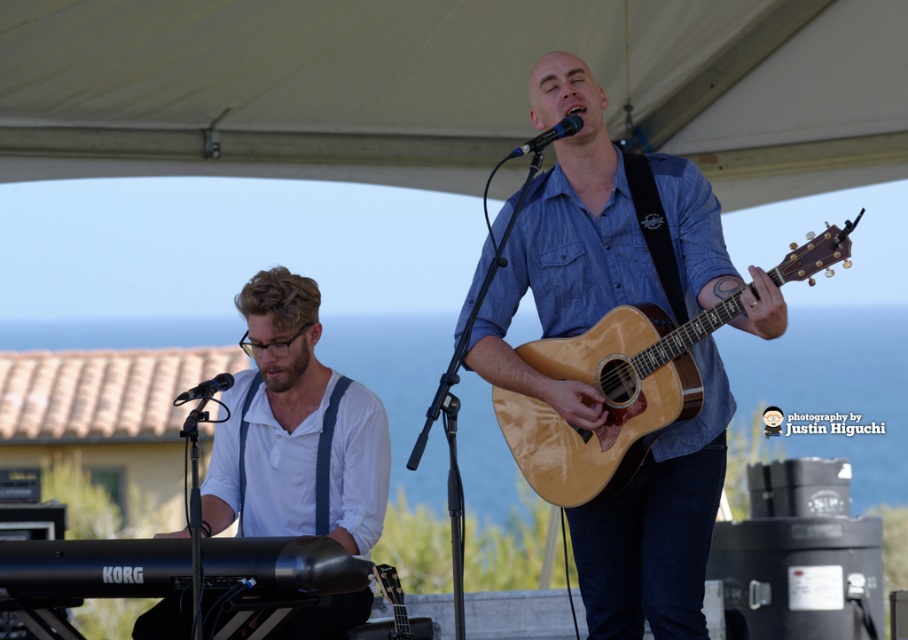
Question: Does denim shirt at center have a larger size compared to white cotton shirt at left?

Choices:
 (A) no
 (B) yes

Answer: (B)

Question: Based on their relative distances, which object is farther from the glossy wood guitar at center?

Choices:
 (A) denim shirt at center
 (B) white cotton shirt at left

Answer: (B)

Question: Does white cotton shirt at left appear over glossy wood guitar at center?

Choices:
 (A) yes
 (B) no

Answer: (B)

Question: Among these points, which one is farthest from the camera?

Choices:
 (A) (576, 259)
 (B) (615, 317)

Answer: (A)

Question: Which of the following is the farthest from the observer?

Choices:
 (A) white cotton shirt at left
 (B) denim shirt at center
 (C) glossy wood guitar at center

Answer: (A)

Question: In this image, where is denim shirt at center located relative to glossy wood guitar at center?

Choices:
 (A) above
 (B) below

Answer: (A)